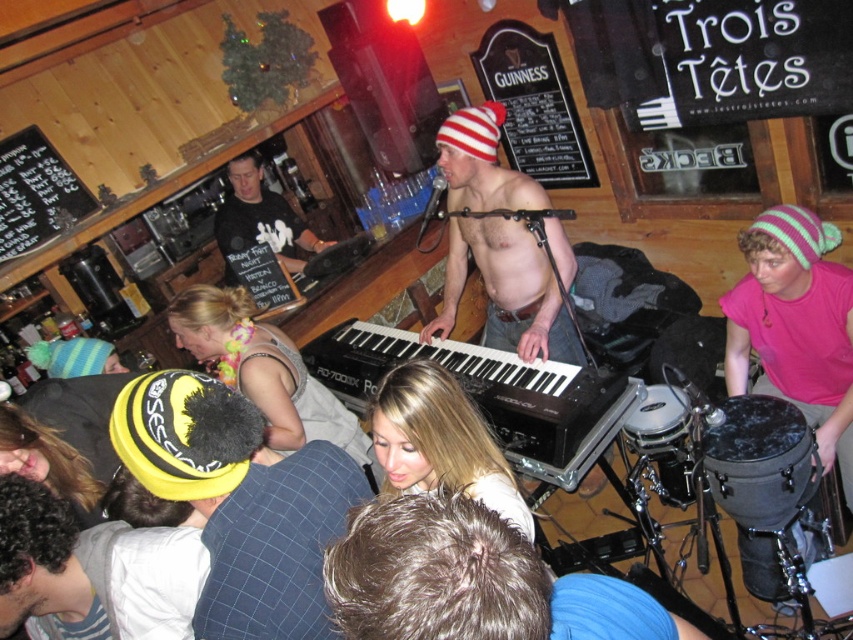
Which is in front, point (410, 358) or point (305, 221)?

Point (410, 358) is in front.

Between black plastic keyboard at center and black matte shirt at center, which one is positioned lower?

Positioned lower is black plastic keyboard at center.

The height and width of the screenshot is (640, 853). I want to click on black plastic keyboard at center, so click(x=491, y=394).

Can you confirm if black chalkboard at upper center is wider than black chalkboard at upper left?

Correct, the width of black chalkboard at upper center exceeds that of black chalkboard at upper left.

Can you confirm if black chalkboard at upper center is smaller than black chalkboard at upper left?

Incorrect, black chalkboard at upper center is not smaller in size than black chalkboard at upper left.

Is point (509, 113) farther from camera compared to point (16, 157)?

Yes, it is behind point (16, 157).

Identify the location of black chalkboard at upper center. This screenshot has width=853, height=640. (532, 104).

Describe the element at coordinates (532, 104) in the screenshot. The width and height of the screenshot is (853, 640). I see `black chalkboard at upper center` at that location.

Locate an element on the screen. The width and height of the screenshot is (853, 640). black chalkboard at upper center is located at coordinates (532, 104).